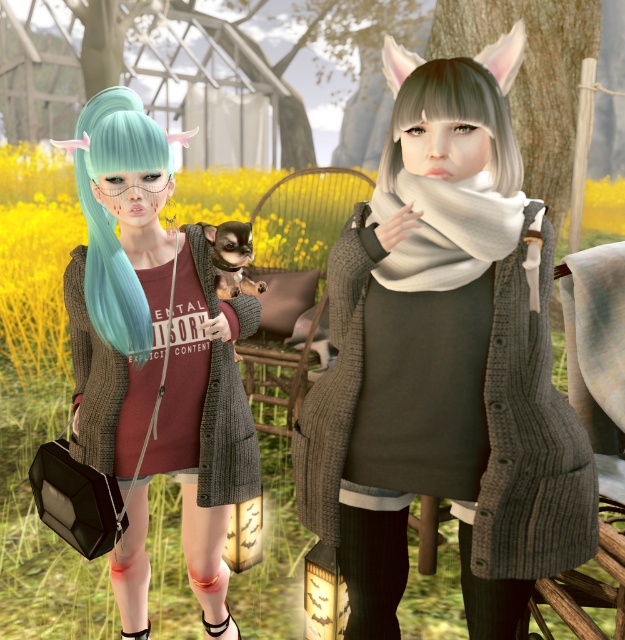
You are a photographer trying to capture a closeup of the teal matte hair at left and the smooth gray scarf at upper right in the scene. Given that your camera has a maximum focus range of 30 inches, will you be able to get both objects in focus at the same time?

The distance between the teal matte hair at left and the smooth gray scarf at upper right is 34.63 inches, which exceeds the camera maximum focus range of 30 inches. Therefore, you cannot get both objects in focus at the same time.